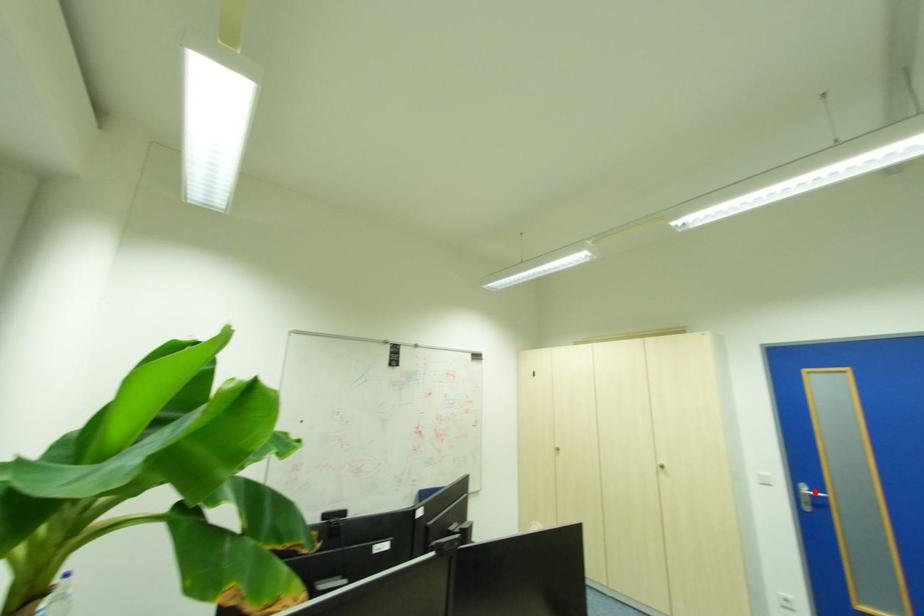
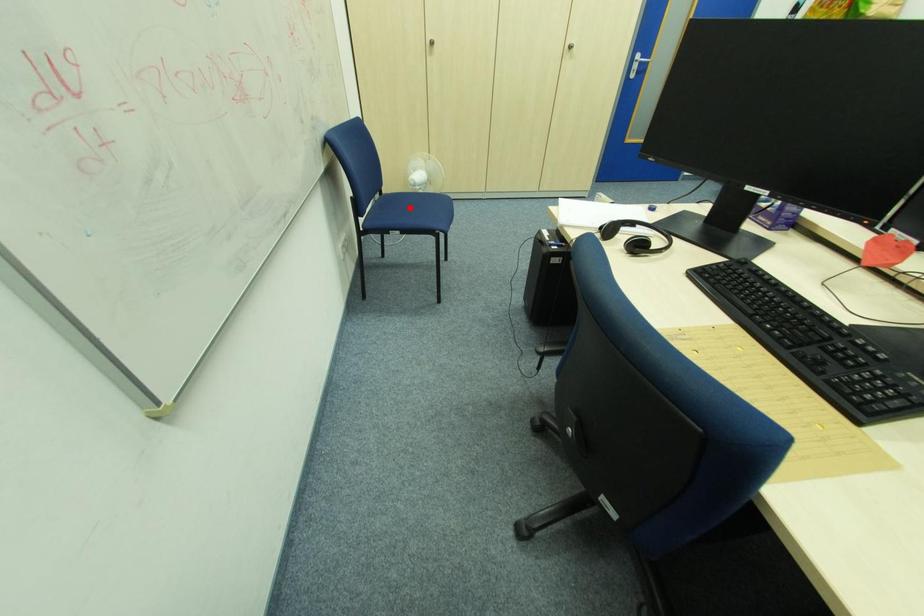
I am providing you with two images of the same scene from different viewpoints. A red point is marked on the first image and another point is marked on the second image. Is the red point in image1 aligned with the point shown in image2?

No